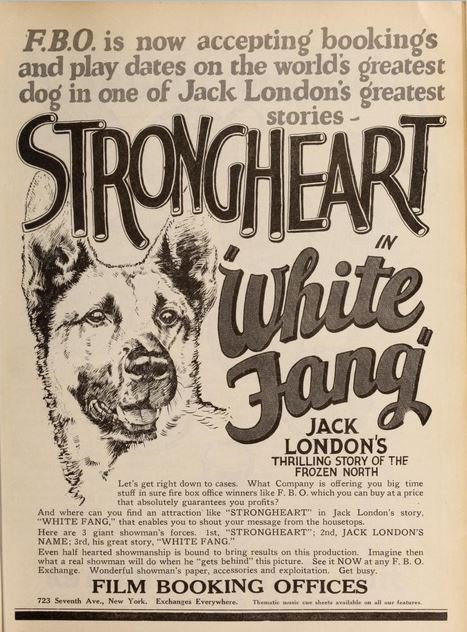
I want to click on movie poster, so click(x=186, y=334).